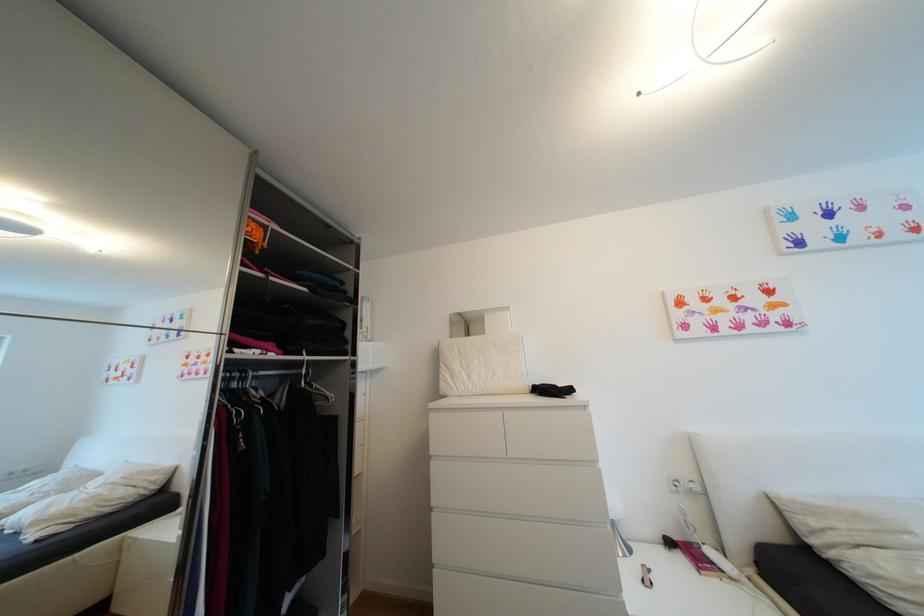
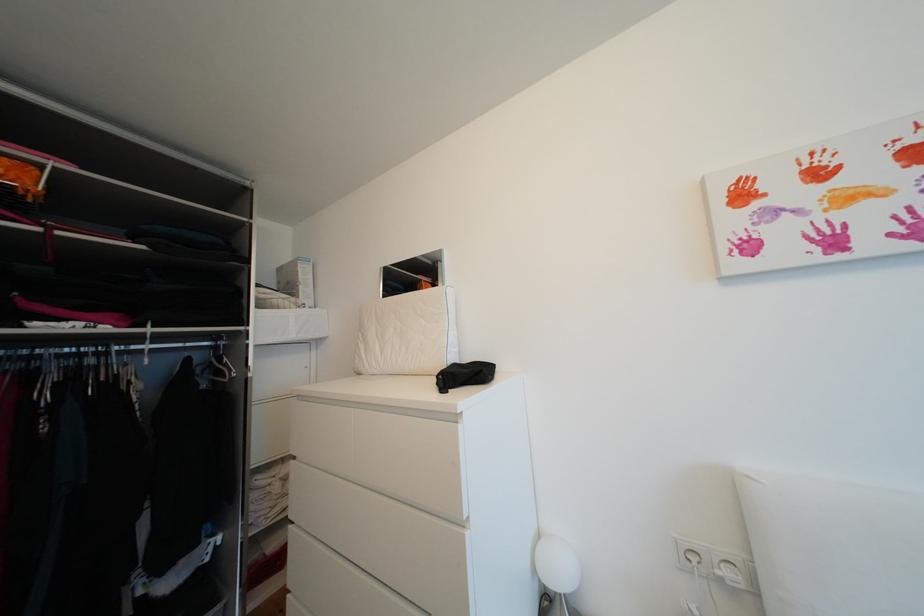
Where in the second image is the point corresponding to point (454, 384) from the first image?

(368, 359)